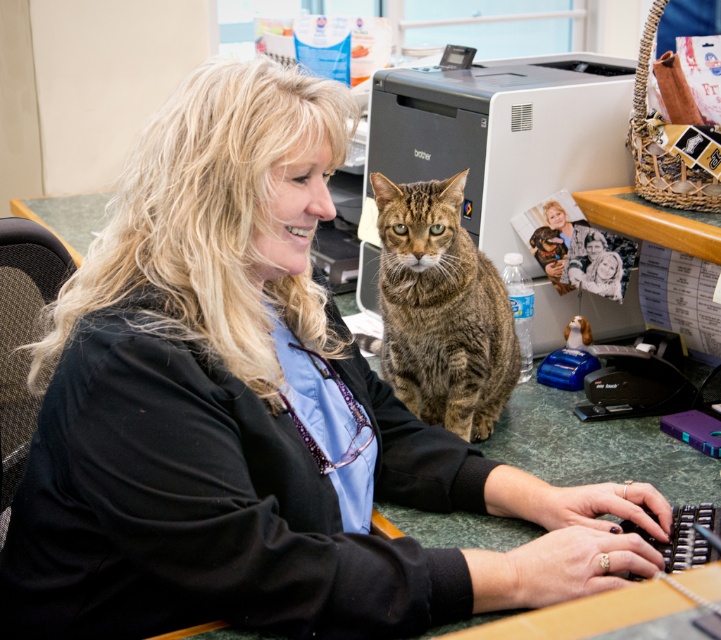
Is matte black printer at center to the left of tabby fur cat at center from the viewer's perspective?

Incorrect, matte black printer at center is not on the left side of tabby fur cat at center.

The image size is (721, 640). What do you see at coordinates (497, 140) in the screenshot? I see `matte black printer at center` at bounding box center [497, 140].

Where is `matte black printer at center`? matte black printer at center is located at coordinates (497, 140).